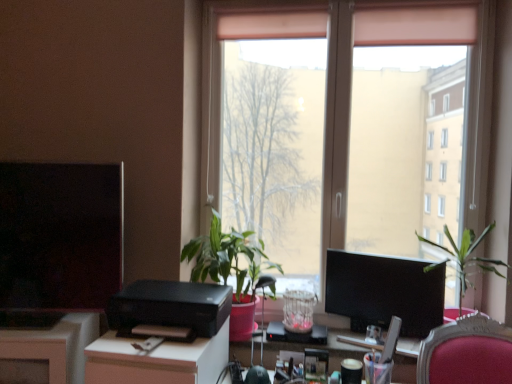
Question: From the image's perspective, is matte black monitor at center right, acting as the 1th computer monitor starting from the right, over transparent glass window at center?

Choices:
 (A) yes
 (B) no

Answer: (B)

Question: Is matte black monitor at center right, which is the second computer monitor in left-to-right order, closer to camera compared to transparent glass window at center?

Choices:
 (A) yes
 (B) no

Answer: (A)

Question: Considering the relative sizes of matte black monitor at center right, acting as the 1th computer monitor starting from the right, and transparent glass window at center in the image provided, is matte black monitor at center right, acting as the 1th computer monitor starting from the right, shorter than transparent glass window at center?

Choices:
 (A) yes
 (B) no

Answer: (A)

Question: Is matte black monitor at center right, which is the second computer monitor in left-to-right order, oriented away from transparent glass window at center?

Choices:
 (A) no
 (B) yes

Answer: (B)

Question: Does matte black monitor at center right, which is the second computer monitor in left-to-right order, have a greater height compared to transparent glass window at center?

Choices:
 (A) yes
 (B) no

Answer: (B)

Question: Is matte black monitor at center right, acting as the 1th computer monitor starting from the right, thinner than transparent glass window at center?

Choices:
 (A) no
 (B) yes

Answer: (B)

Question: Can we say white glossy desk at center lies outside transparent glass window at center?

Choices:
 (A) yes
 (B) no

Answer: (A)

Question: From the image's perspective, does white glossy desk at center appear higher than transparent glass window at center?

Choices:
 (A) no
 (B) yes

Answer: (A)

Question: From a real-world perspective, is white glossy desk at center on transparent glass window at center?

Choices:
 (A) no
 (B) yes

Answer: (A)

Question: Are white glossy desk at center and transparent glass window at center far apart?

Choices:
 (A) yes
 (B) no

Answer: (A)

Question: Is white glossy desk at center in contact with transparent glass window at center?

Choices:
 (A) yes
 (B) no

Answer: (B)

Question: Can you confirm if white glossy desk at center is wider than transparent glass window at center?

Choices:
 (A) yes
 (B) no

Answer: (A)

Question: Are transparent glass window at center and green matte plant at center, placed as the second houseplant when sorted from right to left, beside each other?

Choices:
 (A) yes
 (B) no

Answer: (B)